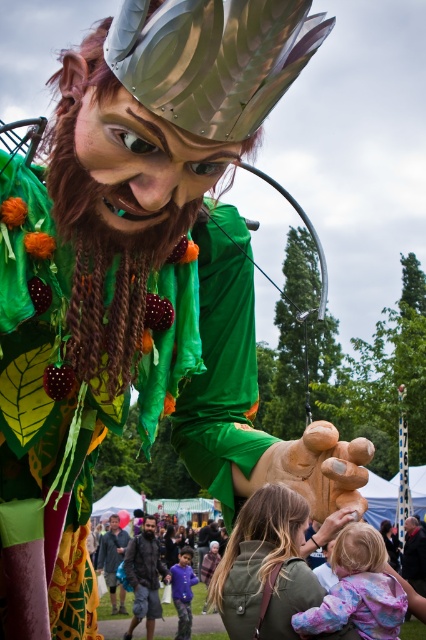
Between point (397, 612) and point (115, 515), which one is positioned behind?

The point (115, 515) is more distant.

Is point (339, 579) positioned behind point (115, 520)?

No, (339, 579) is in front of (115, 520).

Which is behind, point (368, 595) or point (115, 532)?

The point (115, 532) is behind.

Find the location of `pastel tie-dye fabric at lower center`. pastel tie-dye fabric at lower center is located at coordinates (357, 589).

Is matte black helmet at upper center to the left of matte brown wooden head at center from the viewer's perspective?

In fact, matte black helmet at upper center is to the right of matte brown wooden head at center.

The height and width of the screenshot is (640, 426). I want to click on matte black helmet at upper center, so click(411, 524).

Between point (411, 520) and point (382, 524), which one is positioned in front?

Point (411, 520) is in front.

This screenshot has width=426, height=640. Find the location of `matte black helmet at upper center`. matte black helmet at upper center is located at coordinates (411, 524).

Is pastel tie-dye fabric at lower center bigger than dark brown leather jacket at lower center?

No.

Between point (351, 592) and point (149, 531), which one is positioned behind?

Point (149, 531)

Is point (336, 602) positioned in front of point (158, 579)?

Yes, it is.

At what (x,y) coordinates should I click in order to perform the action: click on pastel tie-dye fabric at lower center. Please return your answer as a coordinate pair (x, y). Image resolution: width=426 pixels, height=640 pixels. Looking at the image, I should click on (357, 589).